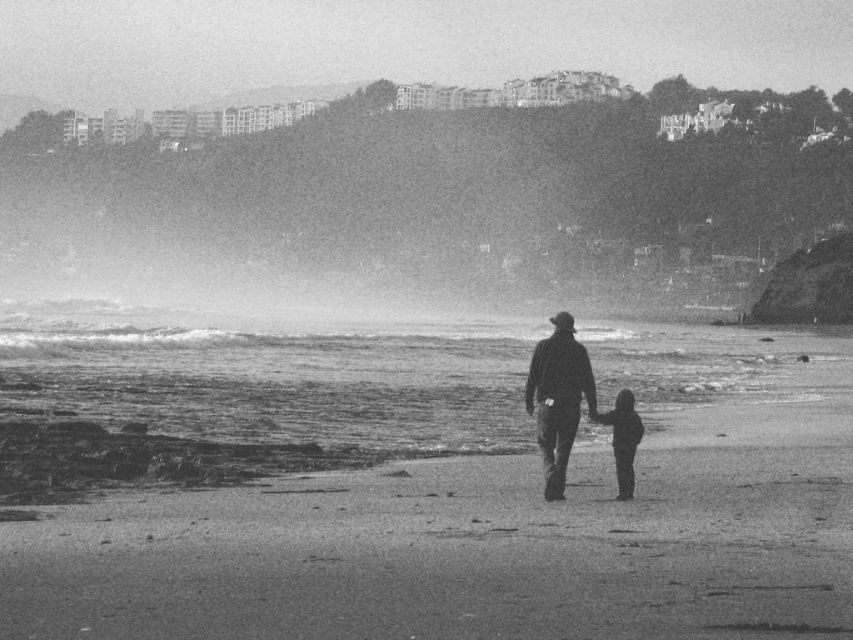
Question: Estimate the real-world distances between objects in this image. Which object is closer to the dark fabric child at lower center?

Choices:
 (A) dark gray fabric jacket at center
 (B) smooth sand beach at center

Answer: (A)

Question: Which object is the farthest from the smooth sand beach at center?

Choices:
 (A) dark fabric child at lower center
 (B) dark gray fabric jacket at center

Answer: (A)

Question: In this image, where is smooth sand beach at center located relative to dark gray fabric jacket at center?

Choices:
 (A) below
 (B) above

Answer: (A)

Question: Can you confirm if dark gray fabric jacket at center is positioned to the left of dark fabric child at lower center?

Choices:
 (A) no
 (B) yes

Answer: (B)

Question: Can you confirm if dark gray fabric jacket at center is wider than dark fabric child at lower center?

Choices:
 (A) yes
 (B) no

Answer: (A)

Question: Which of the following is the farthest from the observer?

Choices:
 (A) (550, 428)
 (B) (625, 429)

Answer: (B)